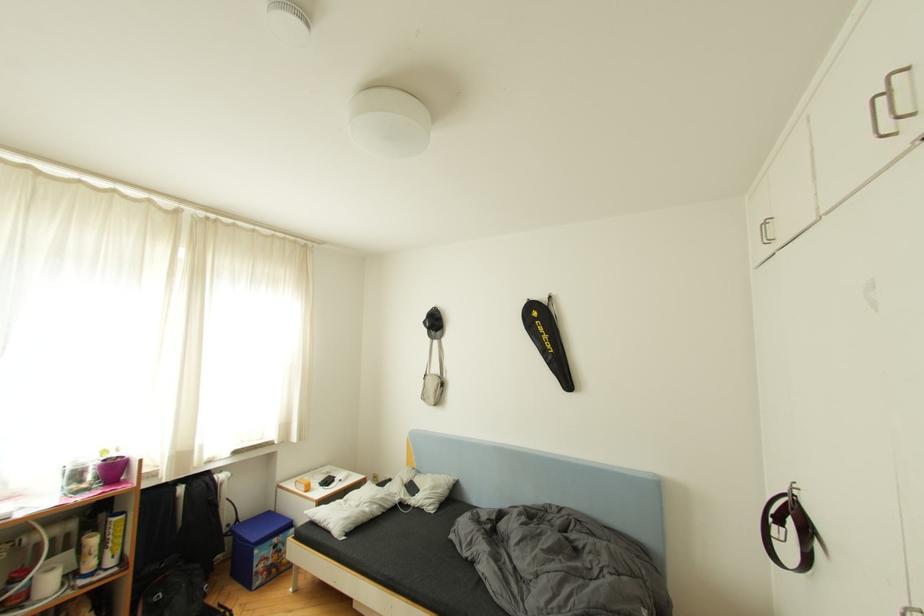
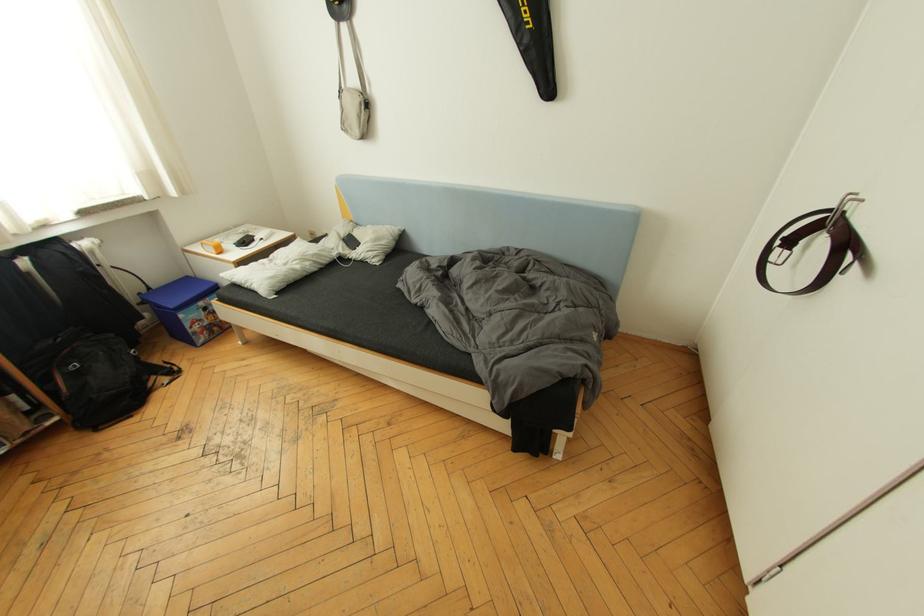
Question: How did the camera likely rotate?

Choices:
 (A) Left
 (B) Right
 (C) Up
 (D) Down

Answer: (D)